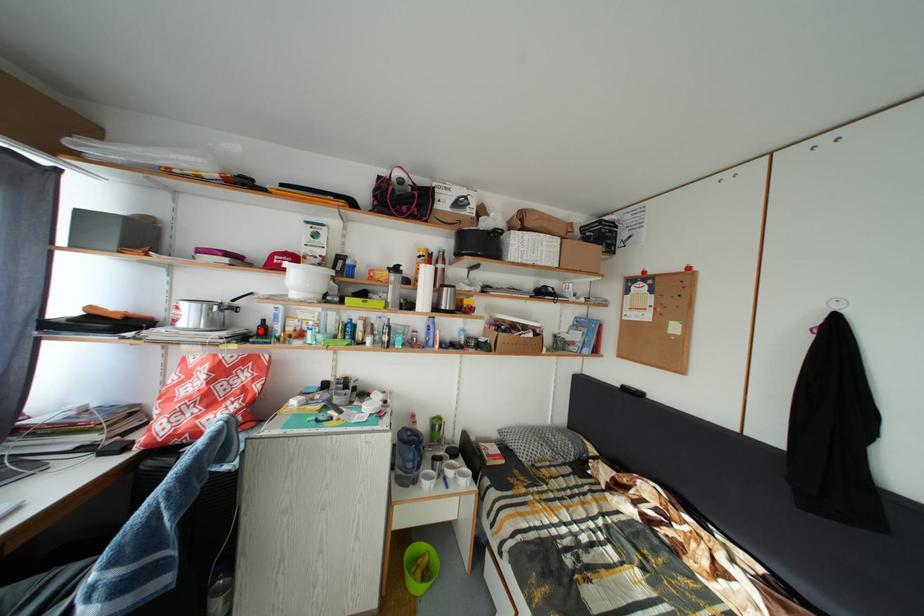
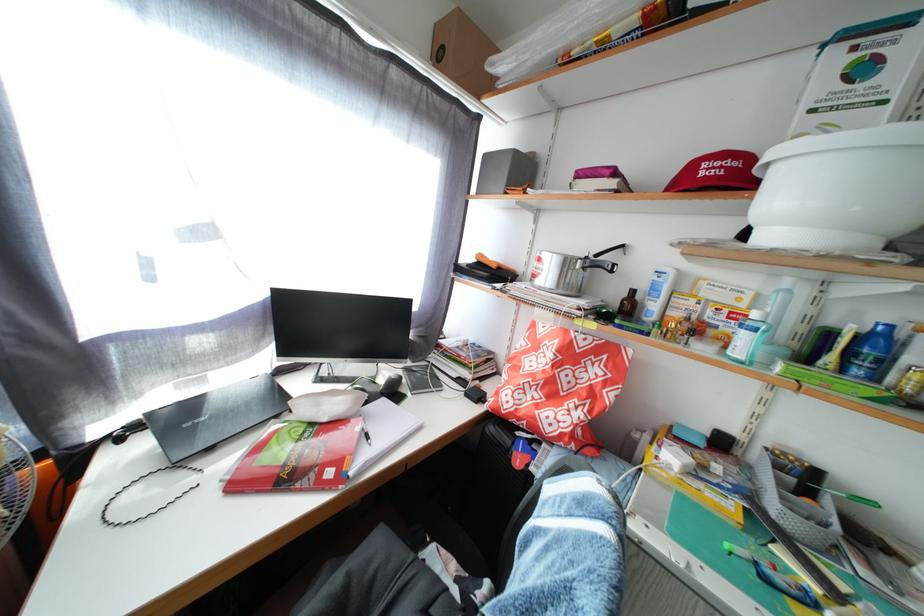
Locate, in the second image, the point that corresponds to the highlighted location in the first image.

(621, 301)